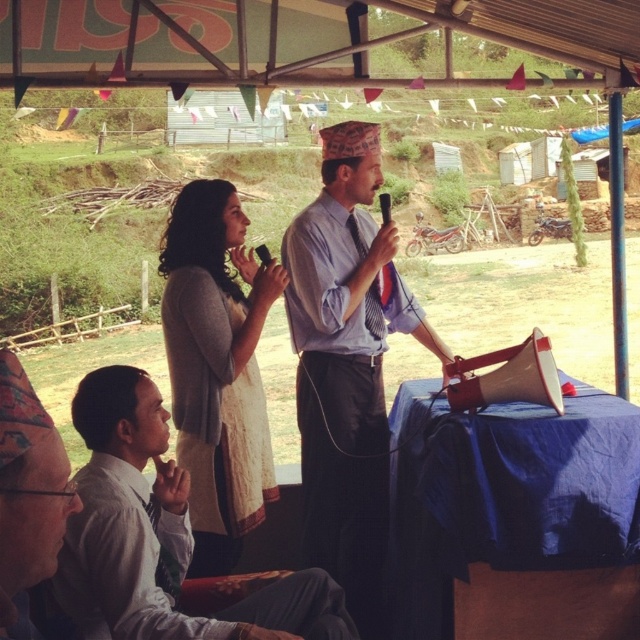
Is blue fabric tablecloth at lower right below light gray shirt at lower left?

No.

What do you see at coordinates (513, 515) in the screenshot? I see `blue fabric tablecloth at lower right` at bounding box center [513, 515].

Find the location of a particular element. Image resolution: width=640 pixels, height=640 pixels. blue fabric tablecloth at lower right is located at coordinates (513, 515).

Does blue fabric tablecloth at lower right have a larger size compared to matte black shirt at lower left?

Correct, blue fabric tablecloth at lower right is larger in size than matte black shirt at lower left.

Who is taller, blue fabric tablecloth at lower right or matte black shirt at lower left?

blue fabric tablecloth at lower right is taller.

Who is more forward, (451, 493) or (13, 438)?

Point (13, 438)

At what (x,y) coordinates should I click in order to perform the action: click on blue fabric tablecloth at lower right. Please return your answer as a coordinate pair (x, y). Looking at the image, I should click on (513, 515).

Is blue fabric tablecloth at lower right bigger than blue striped shirt at center?

No.

Can you confirm if blue fabric tablecloth at lower right is positioned to the right of blue striped shirt at center?

Correct, you'll find blue fabric tablecloth at lower right to the right of blue striped shirt at center.

Is point (628, 600) closer to viewer compared to point (388, 292)?

Yes, it is.

This screenshot has height=640, width=640. I want to click on blue fabric tablecloth at lower right, so click(513, 515).